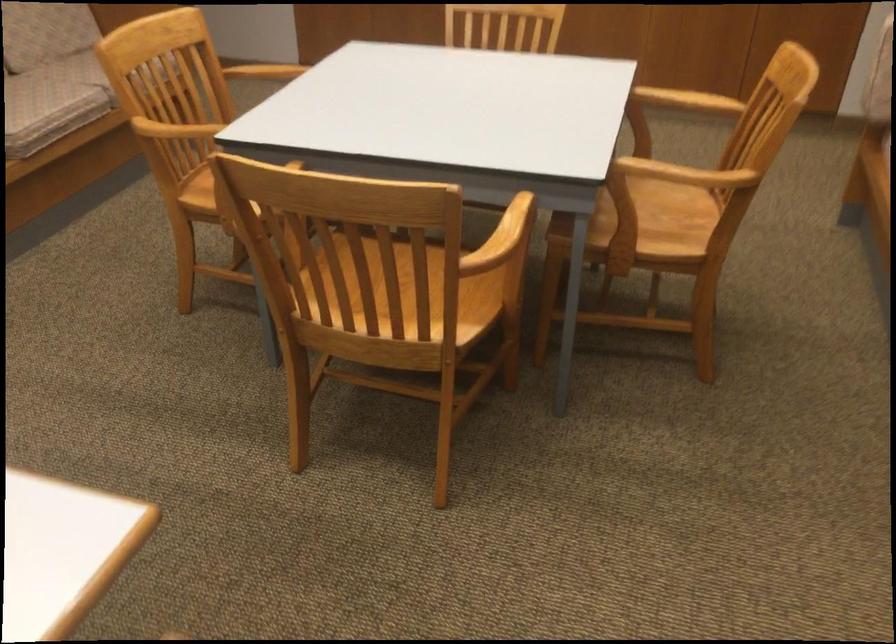
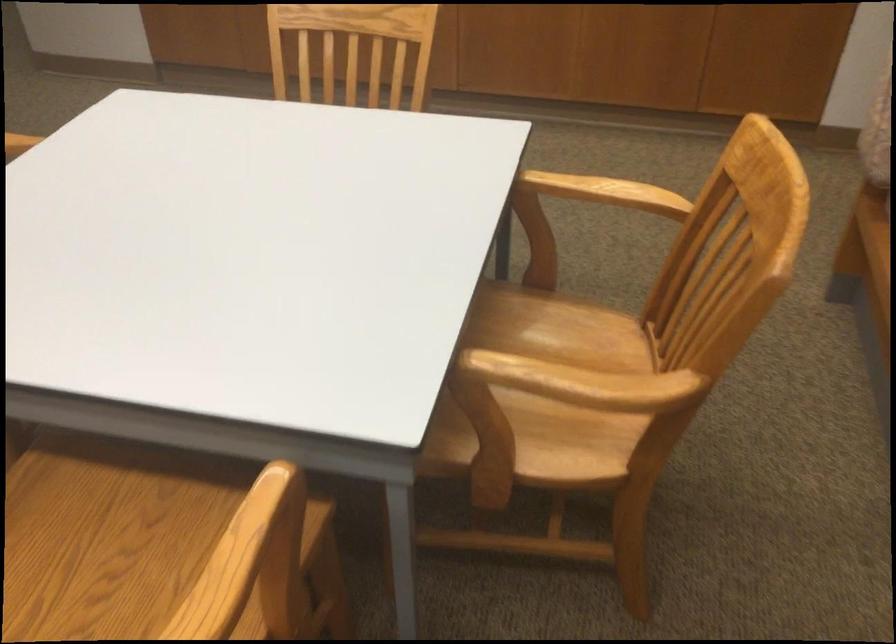
Locate, in the second image, the point that corresponds to point 661,189 in the first image.

(567, 330)